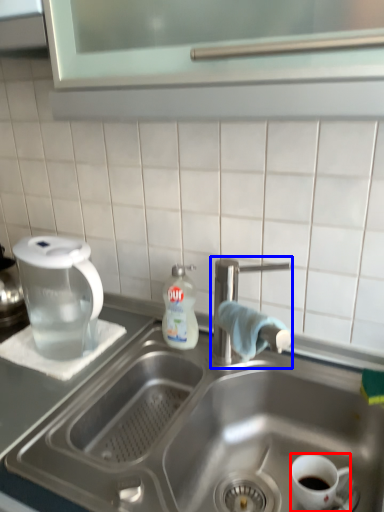
Question: Which point is closer to the camera, coffee cup (highlighted by a red box) or tap (highlighted by a blue box)?

Choices:
 (A) coffee cup
 (B) tap

Answer: (A)